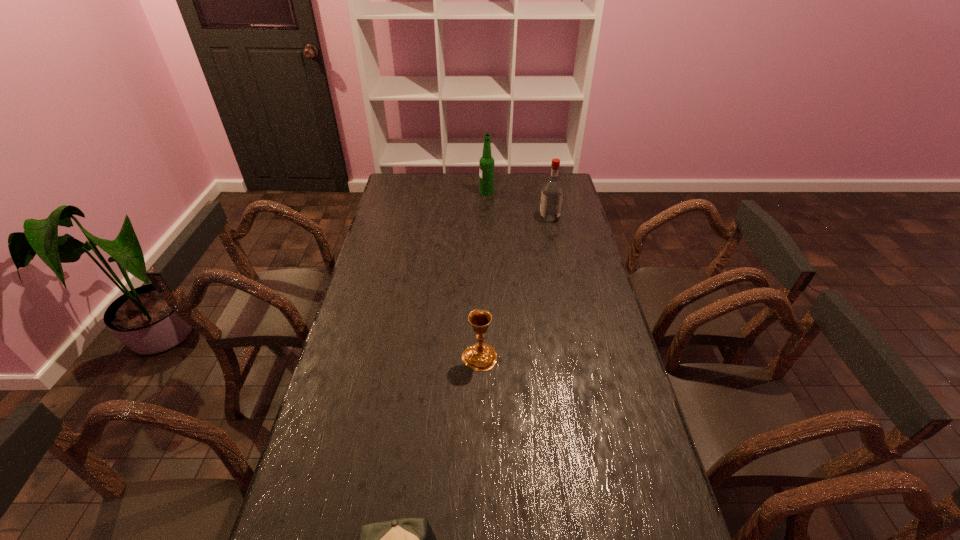
You are a GUI agent. You are given a task and a screenshot of the screen. Output one action in this format:
    pyautogui.click(x=<x>, y=<y>)
    Task: Click on the vacant space located on the front-facing side of the rightmost object
    This screenshot has width=960, height=540.
    Given the screenshot: What is the action you would take?
    pyautogui.click(x=466, y=218)

This screenshot has height=540, width=960. Identify the location of blank space located on the back of the second nearest object. (480, 278).

Find the location of a particular element. This screenshot has width=960, height=540. object that is at the far edge is located at coordinates (486, 163).

Identify the location of object present at the right edge. This screenshot has width=960, height=540. [552, 191].

Identify the location of vacant region at the far edge of the desktop. (532, 180).

You are a GUI agent. You are given a task and a screenshot of the screen. Output one action in this format:
    pyautogui.click(x=<x>, y=<y>)
    Task: Click on the blank space at the left edge of the desktop
    This screenshot has width=960, height=540.
    Given the screenshot: What is the action you would take?
    pyautogui.click(x=388, y=276)

Where is `free space at the right edge of the desktop`? Image resolution: width=960 pixels, height=540 pixels. free space at the right edge of the desktop is located at coordinates (588, 435).

Where is `vacant space at the far left corner`? This screenshot has width=960, height=540. vacant space at the far left corner is located at coordinates (405, 186).

I want to click on unoccupied position between the second shortest object and the liquor, so click(x=515, y=287).

Locate an element on the screen. The width and height of the screenshot is (960, 540). vacant point located between the rightmost object and the third tallest object is located at coordinates (515, 287).